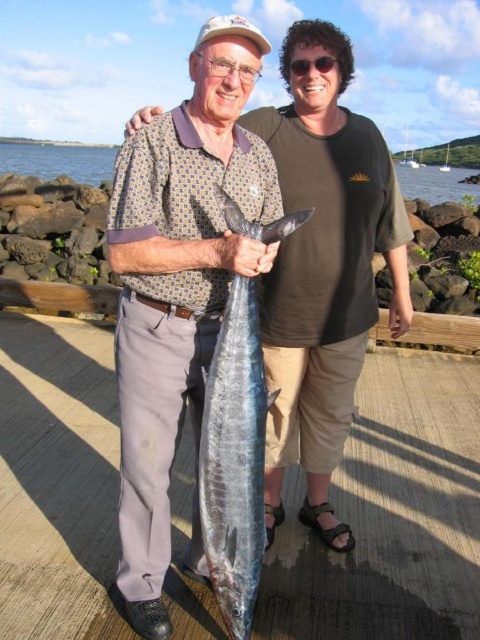
Is shiny metallic fish at center bigger than shiny blue fish at center?

Correct, shiny metallic fish at center is larger in size than shiny blue fish at center.

Can you confirm if shiny metallic fish at center is thinner than shiny blue fish at center?

→ Incorrect, shiny metallic fish at center's width is not less than shiny blue fish at center's.

Is point (219, 250) positioned in front of point (228, 372)?

Yes, point (219, 250) is in front of point (228, 372).

You are a GUI agent. You are given a task and a screenshot of the screen. Output one action in this format:
    pyautogui.click(x=<x>, y=<y>)
    Task: Click on the shiny metallic fish at center
    Image resolution: width=480 pixels, height=640 pixels.
    Given the screenshot: What is the action you would take?
    pyautogui.click(x=179, y=284)

Who is higher up, smooth wood dock at center or shiny metallic fish at center?

shiny metallic fish at center is higher up.

Is point (21, 292) less distant than point (139, 256)?

No, (21, 292) is behind (139, 256).

Locate an element on the screen. The width and height of the screenshot is (480, 640). smooth wood dock at center is located at coordinates (391, 515).

Is point (434, 435) closer to viewer compared to point (240, 573)?

No, (434, 435) is behind (240, 573).

Which is in front, point (62, 476) or point (230, 605)?

Point (230, 605)

Locate an element on the screen. This screenshot has height=640, width=480. smooth wood dock at center is located at coordinates (391, 515).